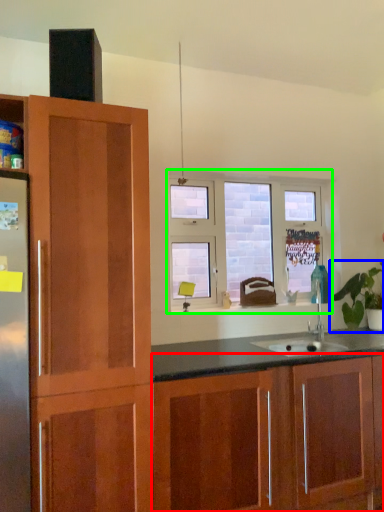
Question: Estimate the real-world distances between objects in this image. Which object is closer to cabinetry (highlighted by a red box), houseplant (highlighted by a blue box) or window (highlighted by a green box)?

Choices:
 (A) houseplant
 (B) window

Answer: (A)